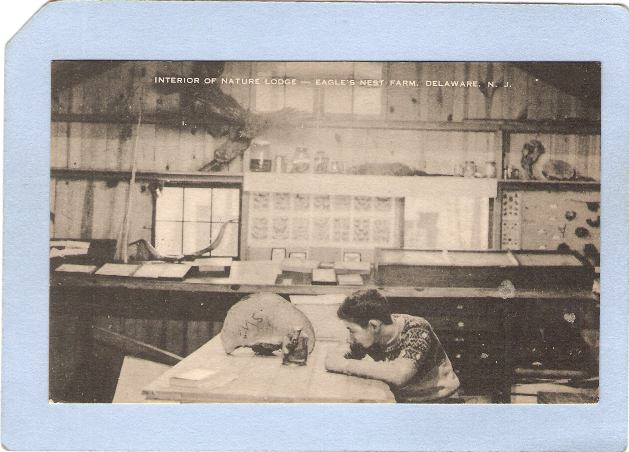
You are a GUI agent. You are given a task and a screenshot of the screen. Output one action in this format:
    pyautogui.click(x=<x>, y=<y>)
    Task: Click on the top left window pane
    This screenshot has height=452, width=629.
    Given the screenshot: What is the action you would take?
    pyautogui.click(x=170, y=205), pyautogui.click(x=253, y=201), pyautogui.click(x=268, y=70)